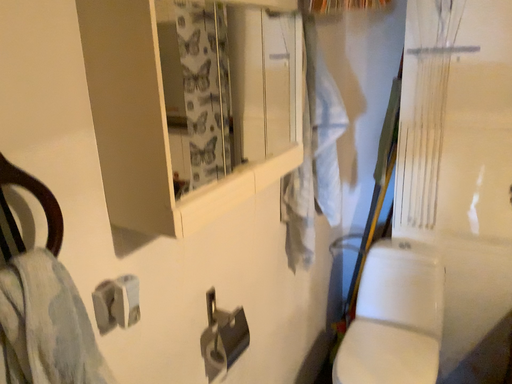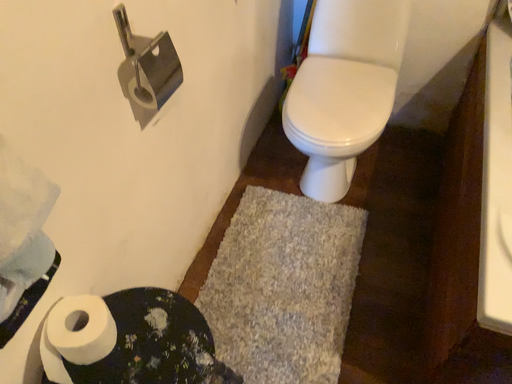
Question: How did the camera likely rotate when shooting the video?

Choices:
 (A) rotated left
 (B) rotated right

Answer: (B)